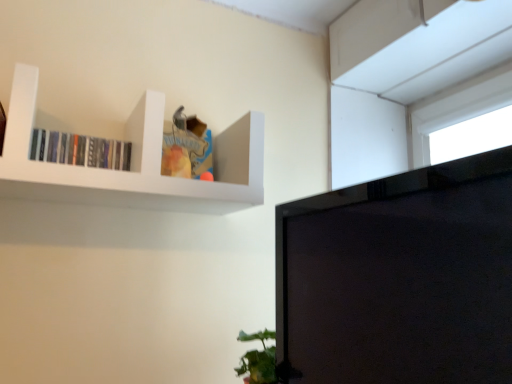
Question: Would you say white matte shelf at upper left is to the left or to the right of black glossy monitor at upper right in the picture?

Choices:
 (A) right
 (B) left

Answer: (B)

Question: Choose the correct answer: Is white matte shelf at upper left inside black glossy monitor at upper right or outside it?

Choices:
 (A) inside
 (B) outside

Answer: (B)

Question: Estimate the real-world distances between objects in this image. Which object is farther from the matte black books at upper left?

Choices:
 (A) white matte shelf at upper left
 (B) black glossy monitor at upper right

Answer: (B)

Question: Which is nearer to the matte black books at upper left?

Choices:
 (A) white matte shelf at upper left
 (B) black glossy monitor at upper right

Answer: (A)